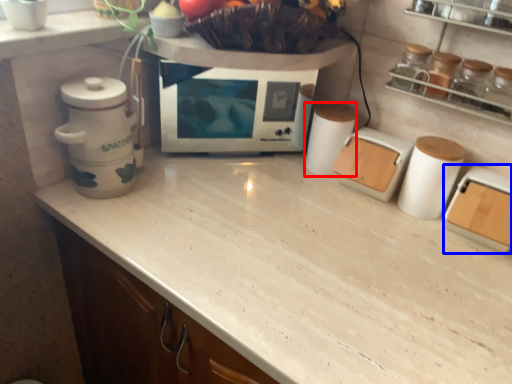
Question: Which object appears closest to the camera in this image, appliance (highlighted by a red box) or kitchen appliance (highlighted by a blue box)?

Choices:
 (A) appliance
 (B) kitchen appliance

Answer: (B)